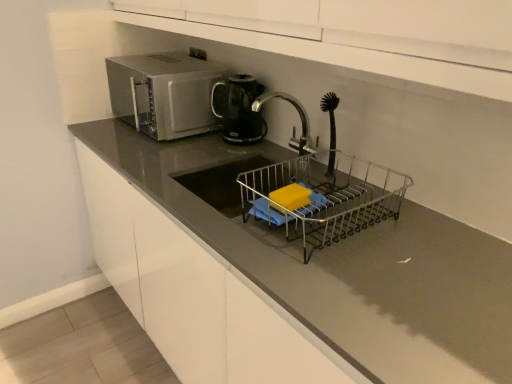
What are the coordinates of `free space that is to the left of yellow sponge at sink` in the screenshot? It's located at (223, 225).